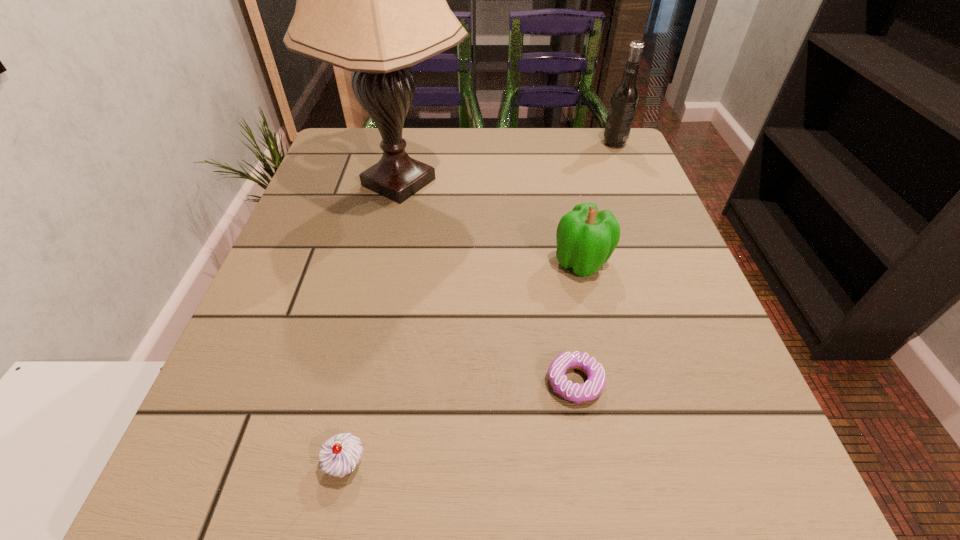
I want to click on free location located 0.250m on the label of the root beer, so (503, 144).

Find the location of a particular element. The image size is (960, 540). vacant point located on the label of the root beer is located at coordinates (515, 144).

Locate an element on the screen. The image size is (960, 540). vacant space located on the label of the root beer is located at coordinates (467, 144).

Identify the location of vacant space located on the back of the bell pepper. This screenshot has width=960, height=540. pos(562,176).

You are a GUI agent. You are given a task and a screenshot of the screen. Output one action in this format:
    pyautogui.click(x=<x>, y=<y>)
    Task: Click on the vacant space located on the right of the cupcake
    
    Given the screenshot: What is the action you would take?
    pyautogui.click(x=540, y=464)

At what (x,y) coordinates should I click in order to perform the action: click on vacant space positioned 0.070m on the left of the doughnut. Please return your answer as a coordinate pair (x, y). Looking at the image, I should click on (498, 382).

The image size is (960, 540). Identify the location of lamp that is at the far edge. point(371,0).

Locate an element on the screen. root beer that is at the far edge is located at coordinates (624, 99).

Image resolution: width=960 pixels, height=540 pixels. Identify the location of object present at the near edge. (339, 455).

At what (x,y) coordinates should I click in order to perform the action: click on object at the left edge. Please return your answer as a coordinate pair (x, y). The width and height of the screenshot is (960, 540). Looking at the image, I should click on (371, 0).